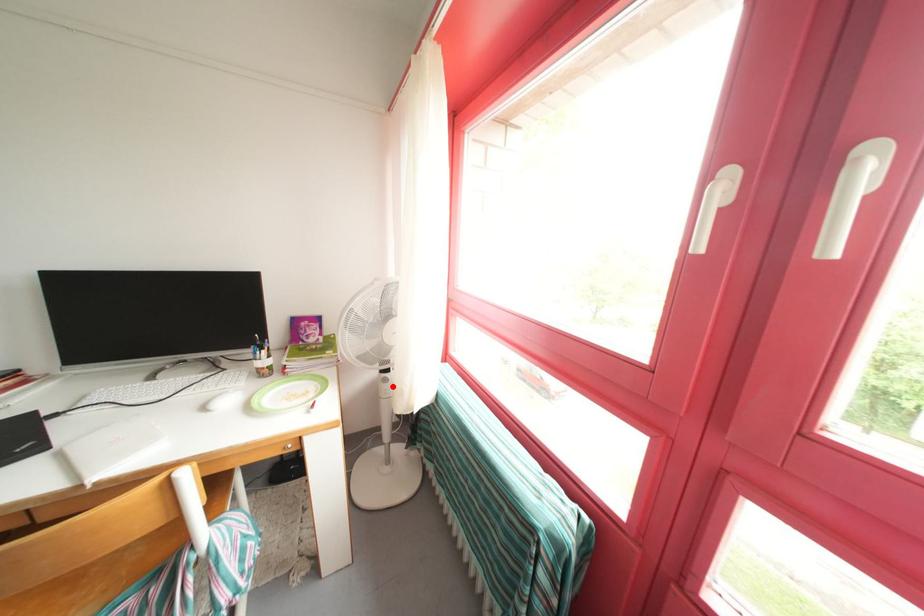
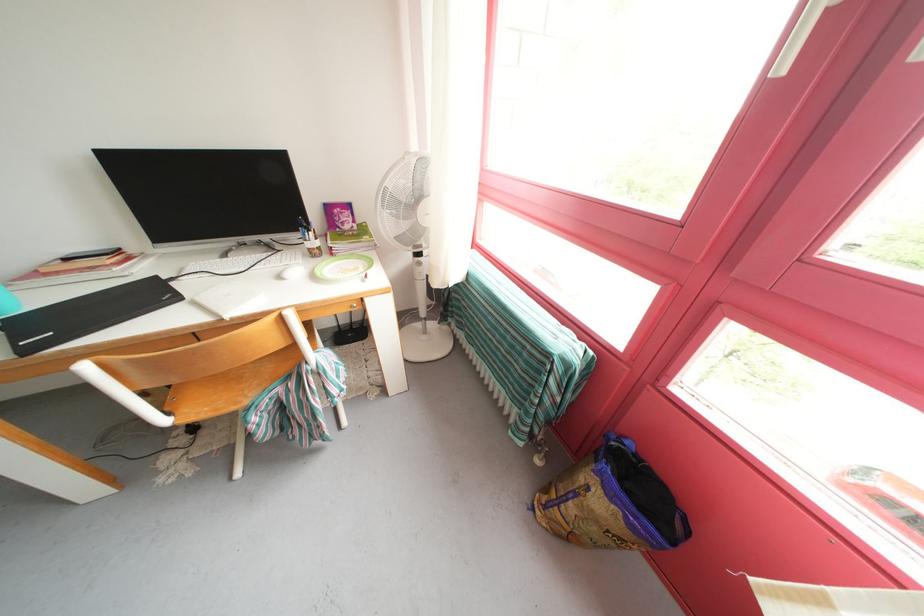
Question: I am providing you with two images of the same scene from different viewpoints. Image1 has a red point marked. In image2, the corresponding 3D location appears at what relative position? Reply with the corresponding letter.

Choices:
 (A) Closer
 (B) Farther

Answer: (A)